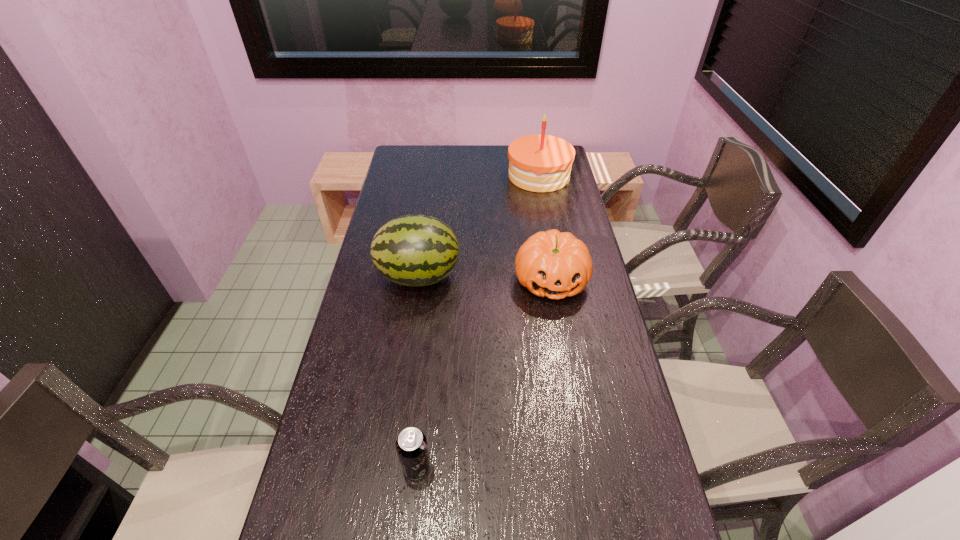
The width and height of the screenshot is (960, 540). I want to click on the tallest object, so click(x=539, y=163).

You are a GUI agent. You are given a task and a screenshot of the screen. Output one action in this format:
    pyautogui.click(x=<x>, y=<y>)
    Task: Click on the birthday cake
    
    Given the screenshot: What is the action you would take?
    pyautogui.click(x=539, y=163)

Find the location of a particular element. watermelon is located at coordinates (413, 250).

At what (x,y) coordinates should I click in order to perform the action: click on pumpkin. Please return your answer as a coordinate pair (x, y). The height and width of the screenshot is (540, 960). Looking at the image, I should click on (551, 264).

Locate an element on the screen. The image size is (960, 540). the shortest object is located at coordinates (411, 444).

You are a GUI agent. You are given a task and a screenshot of the screen. Output one action in this format:
    pyautogui.click(x=<x>, y=<y>)
    Task: Click on the nearest object
    Image resolution: width=960 pixels, height=540 pixels.
    Given the screenshot: What is the action you would take?
    pyautogui.click(x=411, y=444)

Image resolution: width=960 pixels, height=540 pixels. What are the coordinates of `free space located on the front of the tallest object` in the screenshot? It's located at (545, 210).

Identify the location of blank space located at the stem end of the watermelon. Image resolution: width=960 pixels, height=540 pixels. (506, 276).

At what (x,y) coordinates should I click in order to perform the action: click on vacant space located 0.340m on the carved face of the second shortest object. Please return your answer as a coordinate pair (x, y). This screenshot has height=540, width=960. Looking at the image, I should click on (572, 409).

Find the location of a particular element. The height and width of the screenshot is (540, 960). vacant space located on the back of the soda can is located at coordinates (431, 329).